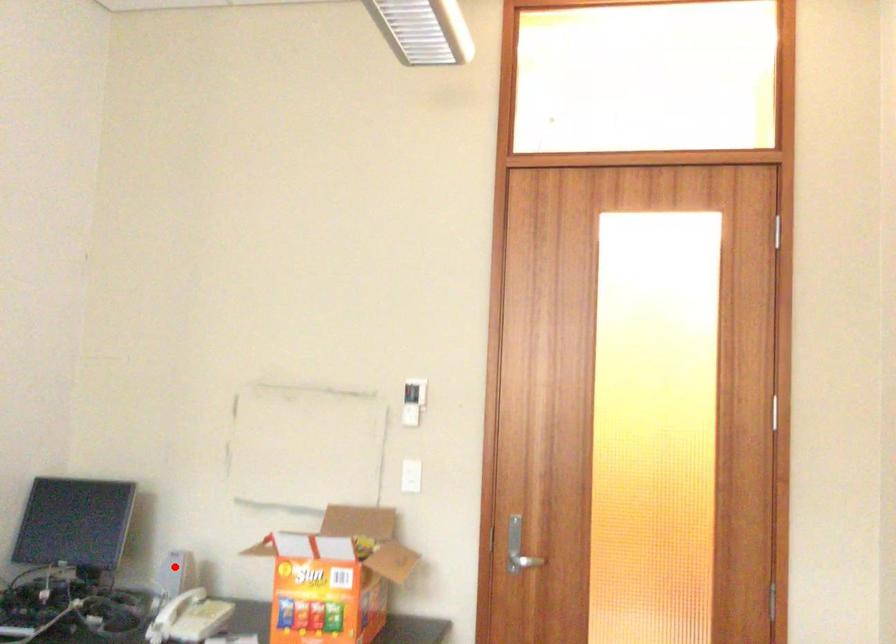
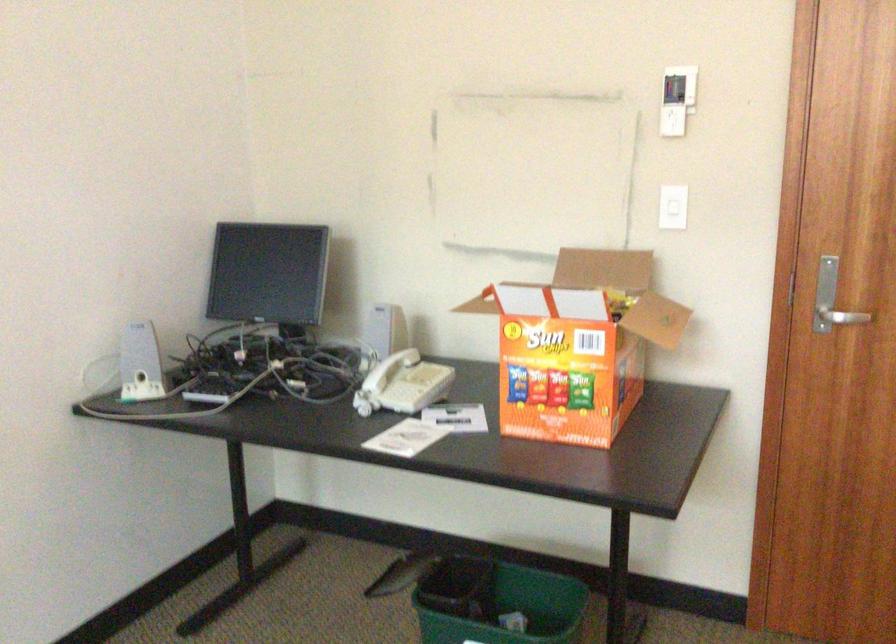
Question: I am providing you with two images of the same scene from different viewpoints. Given a red point in image1, look at the same physical point in image2. Is it:

Choices:
 (A) Closer to the viewpoint
 (B) Farther from the viewpoint

Answer: (A)